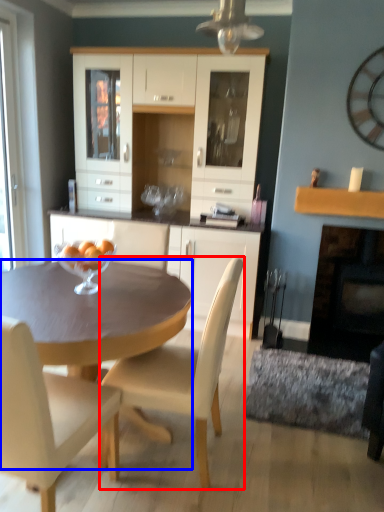
Question: Which object appears farthest to the camera in this image, chair (highlighted by a red box) or desk (highlighted by a blue box)?

Choices:
 (A) chair
 (B) desk

Answer: (A)